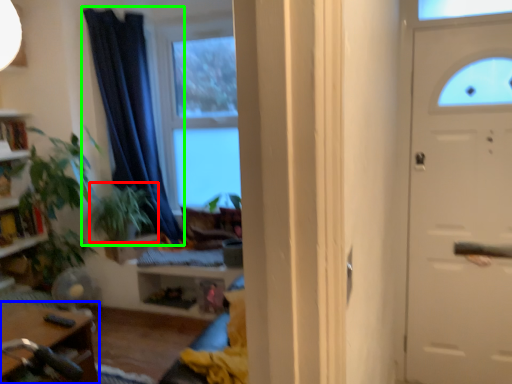
Question: Based on their relative distances, which object is farther from plant (highlighted by a red box)? Choose from table (highlighted by a blue box) and curtain (highlighted by a green box).

Choices:
 (A) table
 (B) curtain

Answer: (A)